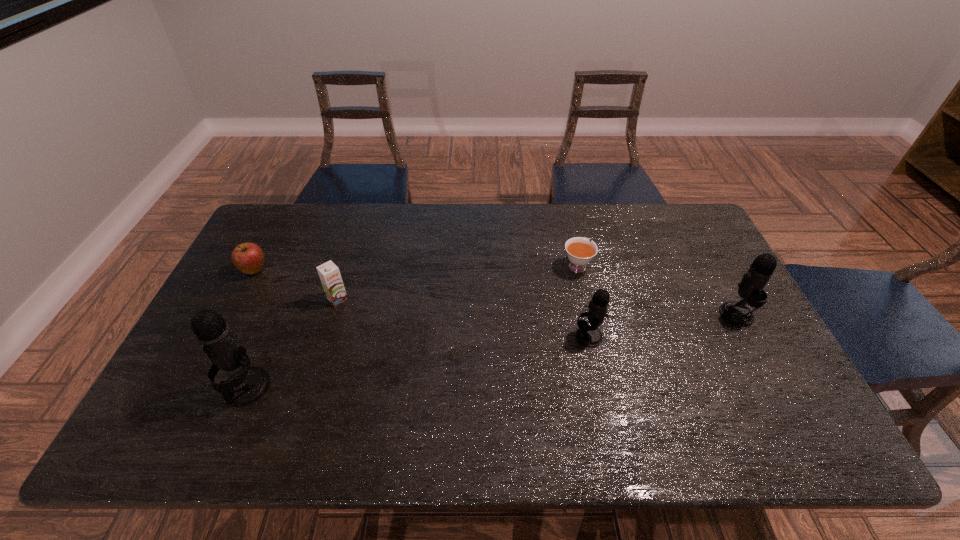
The image size is (960, 540). What are the coordinates of `the leftmost object` in the screenshot? It's located at (248, 257).

The width and height of the screenshot is (960, 540). In order to click on free space located on the back of the tallest object in this screenshot , I will do `click(294, 274)`.

Locate an element on the screen. The height and width of the screenshot is (540, 960). vacant space situated on the left of the shortest microphone is located at coordinates point(427,336).

The image size is (960, 540). Identify the location of vacant space located 0.320m on the left of the second shortest microphone. click(x=608, y=314).

This screenshot has width=960, height=540. In order to click on vacant space located on the left of the fourth tallest object in this screenshot , I will do `click(297, 299)`.

Where is `vacant area situated on the side of the shortest object with the handle`? This screenshot has height=540, width=960. vacant area situated on the side of the shortest object with the handle is located at coordinates (567, 222).

Where is `free space located 0.150m on the side of the shortest object with the handle`? free space located 0.150m on the side of the shortest object with the handle is located at coordinates (567, 225).

Locate an element on the screen. The image size is (960, 540). free space located on the side of the shortest object with the handle is located at coordinates (567, 225).

Identify the location of free space located on the right of the second shortest object. (351, 271).

Identify the location of object that is at the near edge. The height and width of the screenshot is (540, 960). (247, 385).